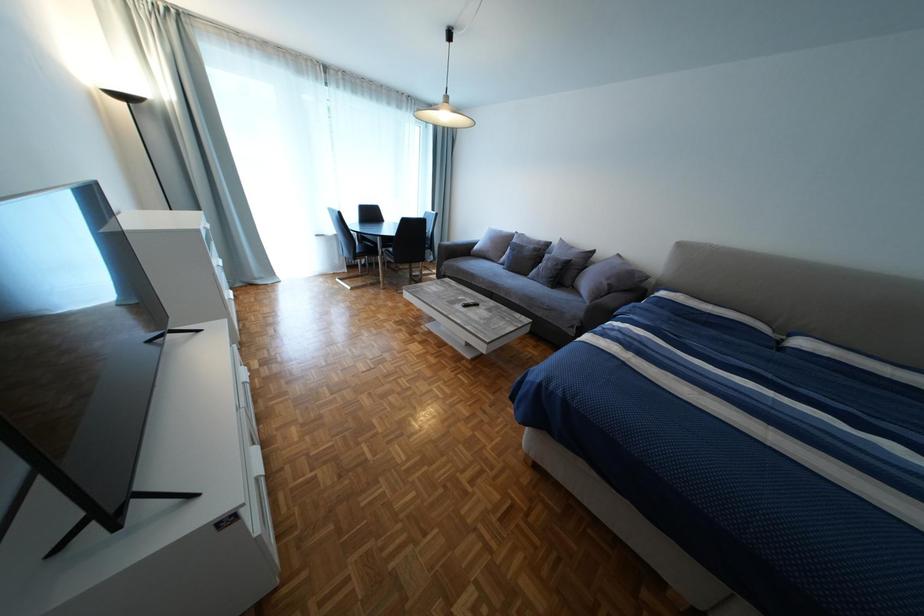
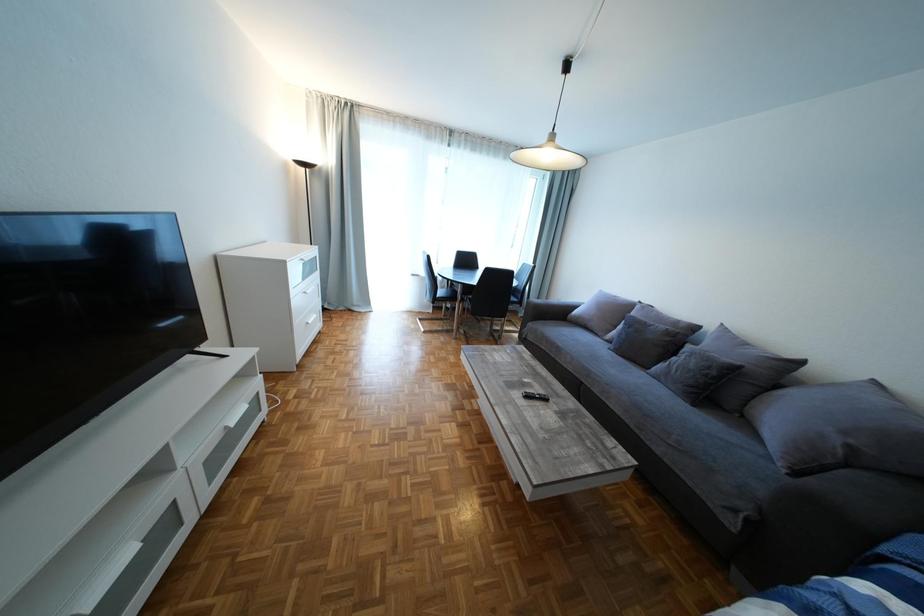
Which direction would the cameraman need to move to produce the second image?

The movement direction of the cameraman is right, forward.